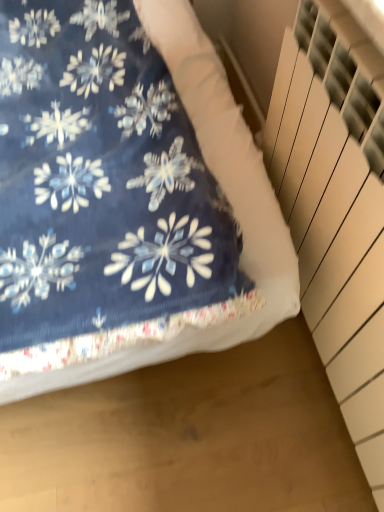
Measure the distance between point (320,192) and camera.

Point (320,192) is 82.50 centimeters from camera.

Describe the element at coordinates (336, 207) in the screenshot. I see `white textured stairwell at right` at that location.

In order to face white textured stairwell at right, should I rotate leftwards or rightwards?

To face it directly, rotate right by 20.121 degrees.

The image size is (384, 512). I want to click on white textured stairwell at right, so click(x=336, y=207).

Describe the element at coordinates (127, 197) in the screenshot. I see `navy blue fabric at upper left` at that location.

In order to face navy blue fabric at upper left, should I rotate leftwards or rightwards?

To face it directly, rotate left by 14.465 degrees.

At what (x,y) coordinates should I click in order to perform the action: click on navy blue fabric at upper left. Please return your answer as a coordinate pair (x, y). Image resolution: width=384 pixels, height=512 pixels. Looking at the image, I should click on (127, 197).

Locate an element on the screen. This screenshot has width=384, height=512. white textured stairwell at right is located at coordinates (336, 207).

Does white textured stairwell at right appear on the right side of navy blue fabric at upper left?

Yes, white textured stairwell at right is to the right of navy blue fabric at upper left.

Is white textured stairwell at right positioned before navy blue fabric at upper left?

Yes, it is in front of navy blue fabric at upper left.

Does point (296, 222) lie behind point (57, 117)?

Yes, it is.

From the image's perspective, is white textured stairwell at right on top of navy blue fabric at upper left?

Incorrect, from the image's perspective, white textured stairwell at right is lower than navy blue fabric at upper left.

From a real-world perspective, relative to navy blue fabric at upper left, is white textured stairwell at right vertically above or below?

white textured stairwell at right is above navy blue fabric at upper left.

Between white textured stairwell at right and navy blue fabric at upper left, which one has larger width?

navy blue fabric at upper left.

Who is shorter, white textured stairwell at right or navy blue fabric at upper left?

Standing shorter between the two is white textured stairwell at right.

Can you confirm if white textured stairwell at right is bigger than navy blue fabric at upper left?

Incorrect, white textured stairwell at right is not larger than navy blue fabric at upper left.

Can we say white textured stairwell at right lies outside navy blue fabric at upper left?

That's correct, white textured stairwell at right is outside of navy blue fabric at upper left.

Are white textured stairwell at right and navy blue fabric at upper left beside each other?

white textured stairwell at right is not next to navy blue fabric at upper left, and they're not touching.

Is white textured stairwell at right facing away from navy blue fabric at upper left?

→ No, white textured stairwell at right is not facing away from navy blue fabric at upper left.

How different are the orientations of white textured stairwell at right and navy blue fabric at upper left in degrees?

The facing directions of white textured stairwell at right and navy blue fabric at upper left are 88.1 degrees apart.

Measure the distance between white textured stairwell at right and navy blue fabric at upper left.

A distance of 11.98 inches exists between white textured stairwell at right and navy blue fabric at upper left.

There is a navy blue fabric at upper left. Where is `stairwell above it (from a real-world perspective)`? The height and width of the screenshot is (512, 384). stairwell above it (from a real-world perspective) is located at coordinates (336, 207).

Would you say navy blue fabric at upper left is to the left or to the right of white textured stairwell at right in the picture?

navy blue fabric at upper left is positioned on white textured stairwell at right's left side.

Who is more distant, navy blue fabric at upper left or white textured stairwell at right?

navy blue fabric at upper left is further from the camera.

Is point (192, 147) positioned behind point (342, 202)?

That is True.

From the image's perspective, does navy blue fabric at upper left appear lower than white textured stairwell at right?

No, from the image's perspective, navy blue fabric at upper left is not beneath white textured stairwell at right.

From a real-world perspective, does navy blue fabric at upper left stand above white textured stairwell at right?

No, from a real-world perspective, navy blue fabric at upper left is not over white textured stairwell at right

Which object is wider, navy blue fabric at upper left or white textured stairwell at right?

navy blue fabric at upper left is wider.

Is navy blue fabric at upper left shorter than white textured stairwell at right?

No, navy blue fabric at upper left is not shorter than white textured stairwell at right.

Looking at this image, does navy blue fabric at upper left have a larger size compared to white textured stairwell at right?

Indeed, navy blue fabric at upper left has a larger size compared to white textured stairwell at right.

Is white textured stairwell at right located within navy blue fabric at upper left?

No, navy blue fabric at upper left does not contain white textured stairwell at right.

Would you say navy blue fabric at upper left is a long distance from white textured stairwell at right?

navy blue fabric at upper left is actually quite close to white textured stairwell at right.

Is navy blue fabric at upper left looking in the opposite direction of white textured stairwell at right?

That's not correct — navy blue fabric at upper left is not looking away from white textured stairwell at right.

Can you tell me how much navy blue fabric at upper left and white textured stairwell at right differ in facing direction?

88.1 degrees separate the facing orientations of navy blue fabric at upper left and white textured stairwell at right.

How far apart are navy blue fabric at upper left and white textured stairwell at right?

The distance of navy blue fabric at upper left from white textured stairwell at right is 11.98 inches.

At what (x,y) coordinates should I click in order to perform the action: click on bed beneath the white textured stairwell at right (from a real-world perspective). Please return your answer as a coordinate pair (x, y). This screenshot has height=512, width=384. Looking at the image, I should click on (127, 197).

Where is `bed above the white textured stairwell at right (from the image's perspective)`? This screenshot has width=384, height=512. bed above the white textured stairwell at right (from the image's perspective) is located at coordinates (127, 197).

Where is `bed that appears behind the white textured stairwell at right`? This screenshot has width=384, height=512. bed that appears behind the white textured stairwell at right is located at coordinates (127, 197).